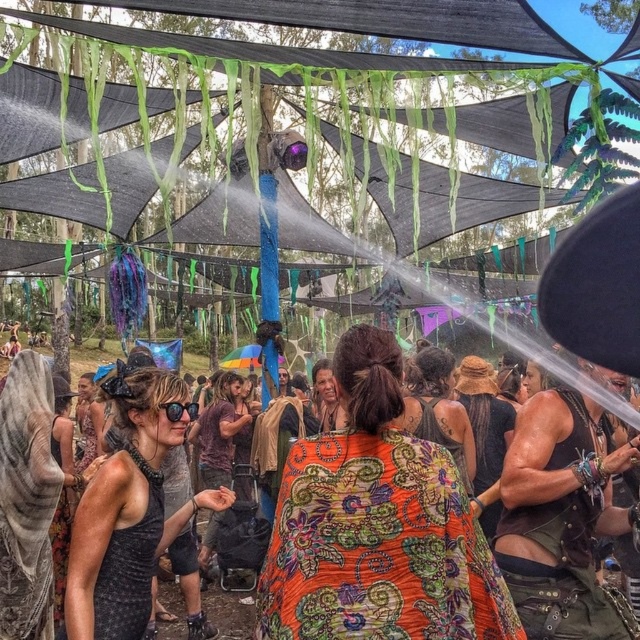
Does leather vest at center have a smaller size compared to black mesh tank top at center?

Correct, leather vest at center occupies less space than black mesh tank top at center.

Identify the location of leather vest at center. (561, 515).

Does orange floral fabric at center have a lesser height compared to leather vest at center?

Correct, orange floral fabric at center is not as tall as leather vest at center.

Is the position of orange floral fabric at center more distant than that of leather vest at center?

No, it is not.

I want to click on orange floral fabric at center, so click(349, 499).

Can you confirm if orange floral fabric at center is shorter than black mesh tank top at center?

Indeed, orange floral fabric at center has a lesser height compared to black mesh tank top at center.

At what (x,y) coordinates should I click in order to perform the action: click on orange floral fabric at center. Please return your answer as a coordinate pair (x, y). Looking at the image, I should click on (349, 499).

Is point (320, 484) positioned behind point (124, 545)?

No, (320, 484) is closer to viewer.

In order to click on orange floral fabric at center in this screenshot , I will do `click(349, 499)`.